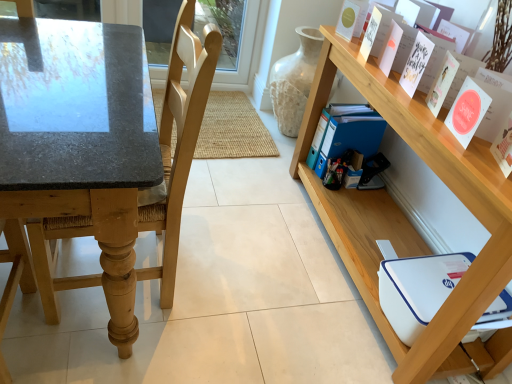
The height and width of the screenshot is (384, 512). I want to click on vacant space in front of pink matte paper at upper right, placed as the fourth paperback book when sorted from front to back, so click(399, 88).